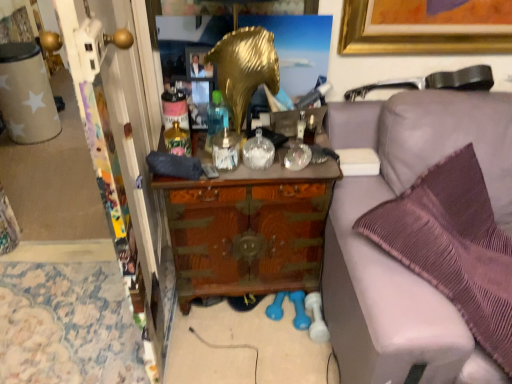
The image size is (512, 384). I want to click on empty space that is ontop of wooden chest at center (from a real-world perspective), so click(236, 137).